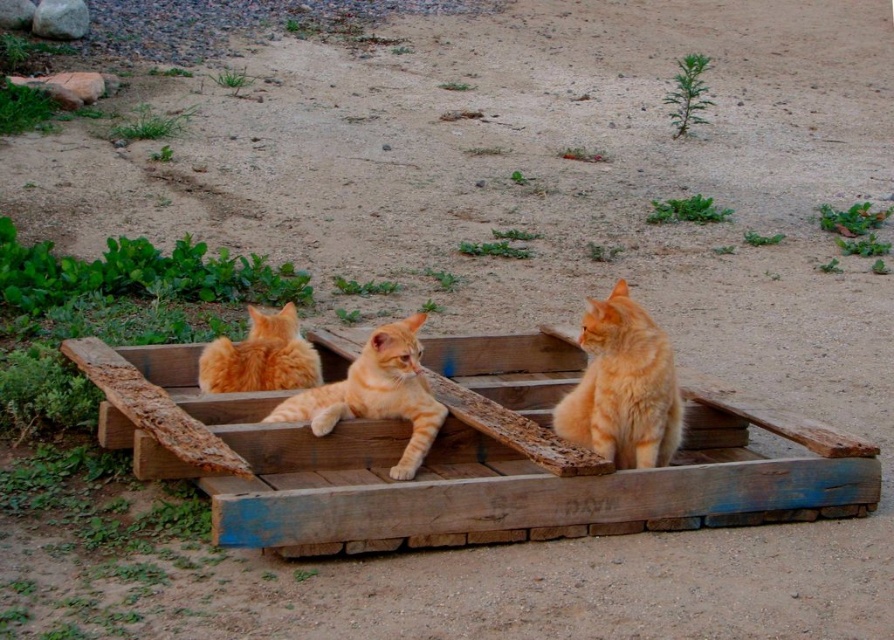
Which is above, orange fur cat at right or orange tabby cat at center?

orange fur cat at right is higher up.

Between point (667, 404) and point (376, 400), which one is positioned behind?

Positioned behind is point (376, 400).

I want to click on orange fur cat at right, so click(623, 387).

Between point (585, 506) and point (415, 348), which one is positioned in front?

Point (585, 506) is more forward.

The image size is (894, 640). What do you see at coordinates (460, 456) in the screenshot?
I see `weathered wood crate at center` at bounding box center [460, 456].

Between point (403, 538) and point (390, 348), which one is positioned in front?

Positioned in front is point (403, 538).

Identify the location of weathered wood crate at center. (460, 456).

Can you confirm if weathered wood crate at center is positioned below orange fur cat at center?

Yes, weathered wood crate at center is below orange fur cat at center.

This screenshot has width=894, height=640. What do you see at coordinates (460, 456) in the screenshot?
I see `weathered wood crate at center` at bounding box center [460, 456].

Between point (797, 493) and point (309, 368), which one is positioned in front?

Point (797, 493) is more forward.

You are a GUI agent. You are given a task and a screenshot of the screen. Output one action in this format:
    pyautogui.click(x=<x>, y=<y>)
    Task: Click on the weathered wood crate at center
    This screenshot has height=640, width=894.
    Given the screenshot: What is the action you would take?
    pyautogui.click(x=460, y=456)